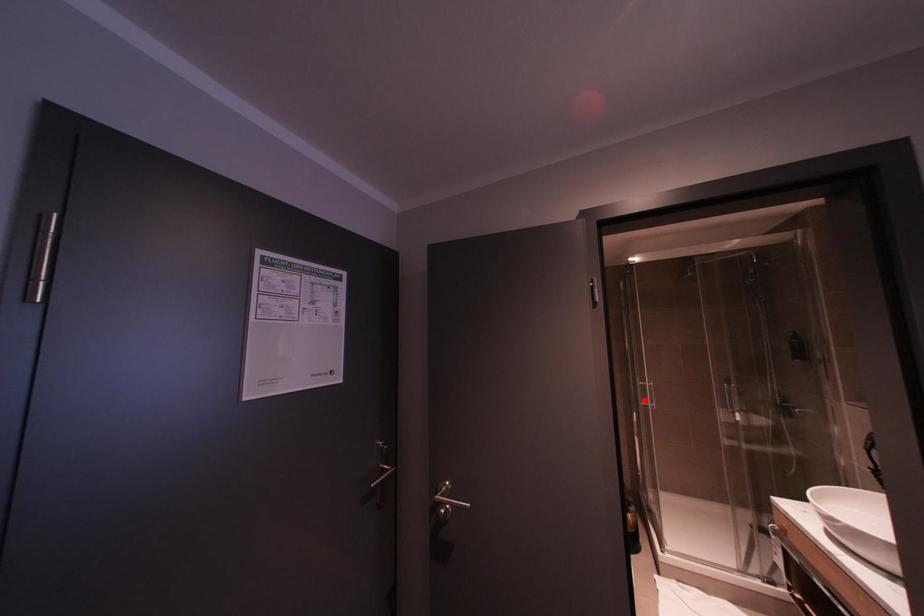
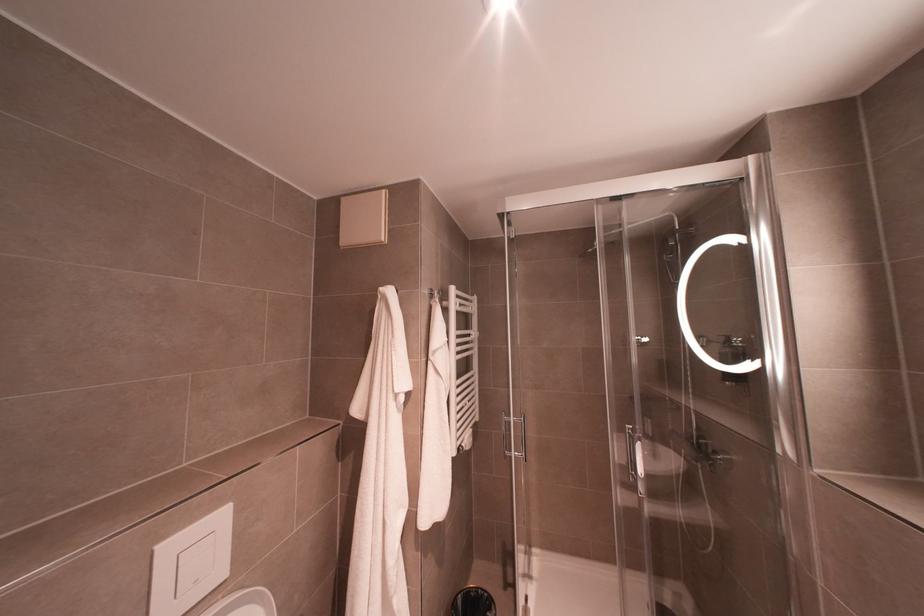
Where in the second image is the point corresponding to the highlighted location from the first image?

(511, 451)